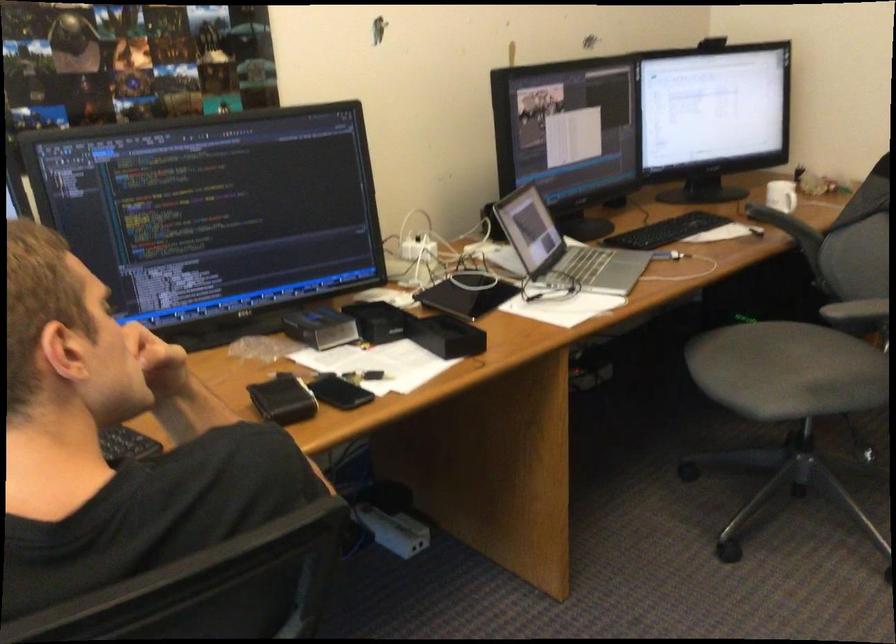
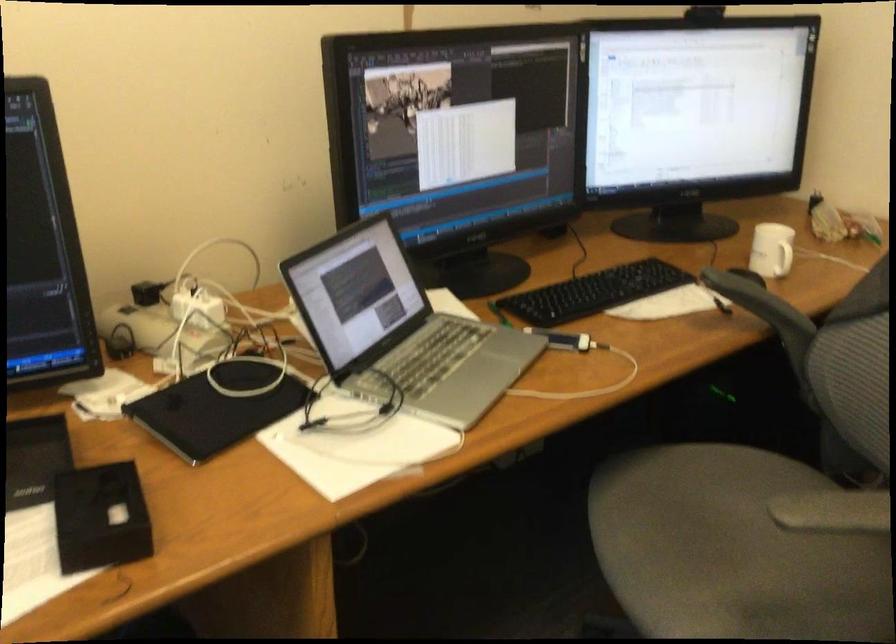
The point at (442, 334) is marked in the first image. Where is the corresponding point in the second image?

(100, 518)